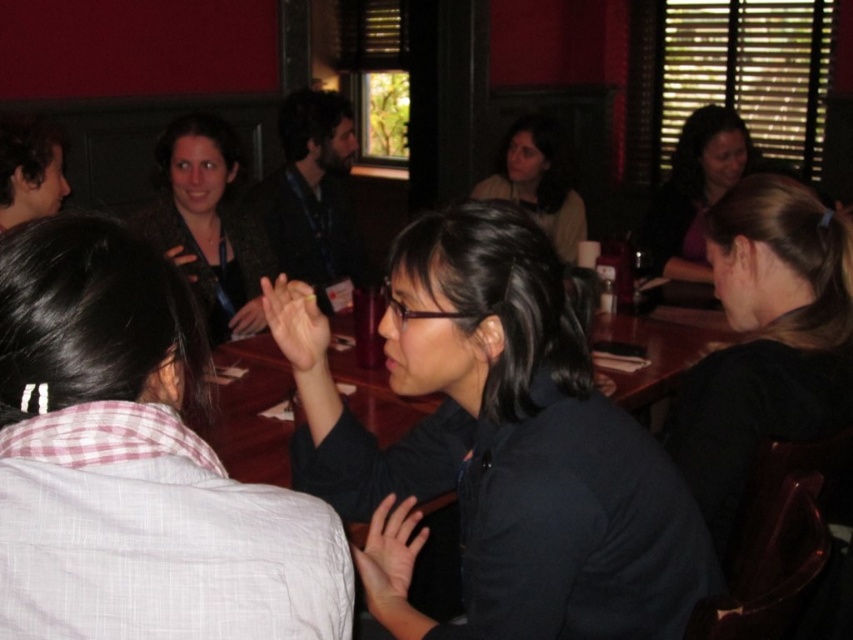
Question: Can you confirm if black matte shirt at center is bigger than plaid shirt at center?

Choices:
 (A) yes
 (B) no

Answer: (A)

Question: Estimate the real-world distances between objects in this image. Which object is closer to the black matte shirt at center?

Choices:
 (A) shiny black jacket at upper left
 (B) matte black shirt at center

Answer: (A)

Question: Which object is farther from the camera taking this photo?

Choices:
 (A) shiny black jacket at upper left
 (B) plaid shirt at center
 (C) matte purple shirt at upper right

Answer: (C)

Question: Which object appears closest to the camera in this image?

Choices:
 (A) shiny black jacket at upper left
 (B) plaid shirt at center
 (C) black matte shirt at center

Answer: (B)

Question: Is black matte shirt at right thinner than matte purple shirt at upper right?

Choices:
 (A) no
 (B) yes

Answer: (B)

Question: Does black matte shirt at right have a smaller size compared to matte purple shirt at upper right?

Choices:
 (A) yes
 (B) no

Answer: (A)